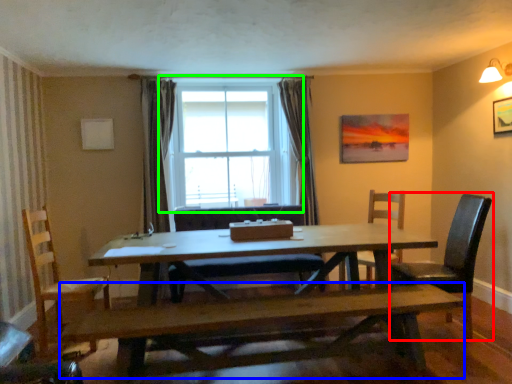
Question: Considering the real-world distances, which object is farthest from chair (highlighted by a red box)? bench (highlighted by a blue box) or window (highlighted by a green box)?

Choices:
 (A) bench
 (B) window

Answer: (B)